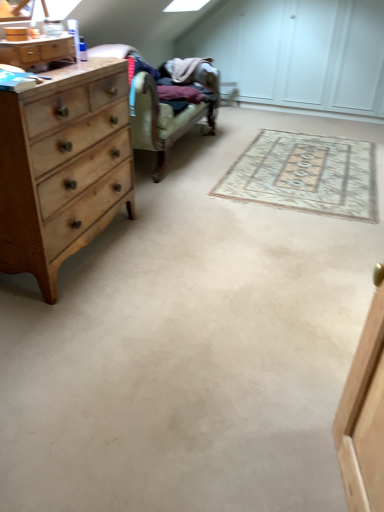
This screenshot has height=512, width=384. In order to click on free location in front of beige woven rug at center in this screenshot , I will do `click(261, 252)`.